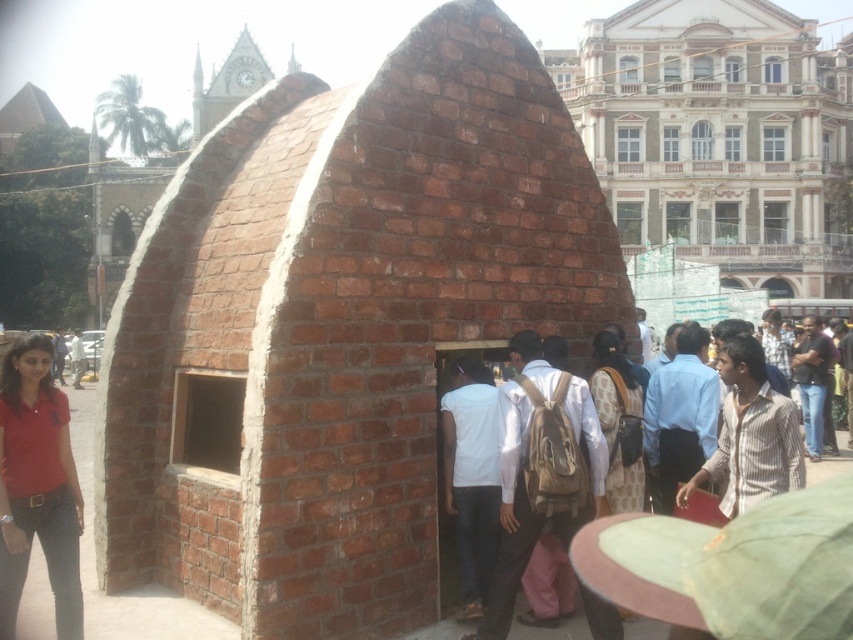
Question: From the image, what is the correct spatial relationship of brown backpack at center in relation to matte red polo shirt at lower left?

Choices:
 (A) below
 (B) above

Answer: (A)

Question: Which point is closer to the camera?

Choices:
 (A) brown backpack at center
 (B) matte red polo shirt at lower left

Answer: (A)

Question: Can you confirm if brown backpack at center is wider than matte red polo shirt at lower left?

Choices:
 (A) no
 (B) yes

Answer: (B)

Question: Which object is farther from the camera taking this photo?

Choices:
 (A) brown backpack at center
 (B) matte red polo shirt at lower left

Answer: (B)

Question: Is brown backpack at center above matte red polo shirt at lower left?

Choices:
 (A) yes
 (B) no

Answer: (B)